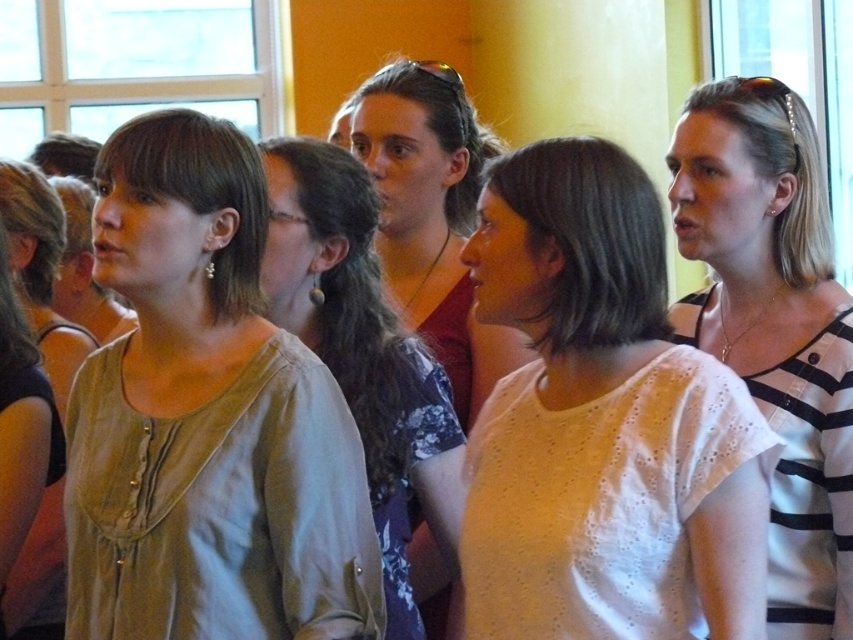
You are organizing a clothing donation drive and need to categorize blouses by size. You have two blouses in front of you, the matte beige blouse at center and the light beige blouse at center. Which one should you place in the large size bin?

The matte beige blouse at center should be placed in the large size bin because it has a larger size compared to the light beige blouse at center.

You are standing at the point marked as point (x=160, y=612) in the image. The door to exit is 18.67 feet away from you. Can you walk straight to the door without any obstacles?

Yes, since the distance between you and the door is 18.67 feet, which is the same as the distance specified in the objects description, you can walk straight to the door without any obstacles.